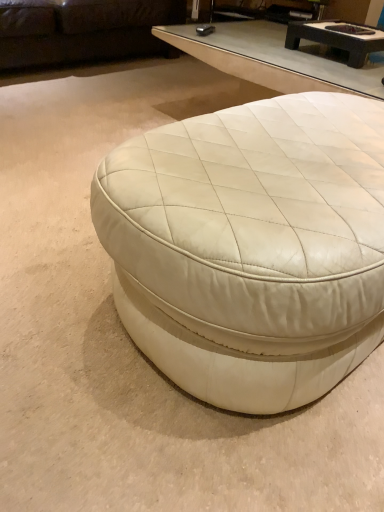
Question: Is white leather ottoman at center, acting as the 1th coffee table starting from the bottom, looking in the opposite direction of dark brown textured wood coffee table at upper center, acting as the 1th coffee table starting from the back?

Choices:
 (A) yes
 (B) no

Answer: (B)

Question: Is white leather ottoman at center, acting as the 1th coffee table starting from the bottom, behind dark brown textured wood coffee table at upper center, acting as the 1th coffee table starting from the back?

Choices:
 (A) yes
 (B) no

Answer: (B)

Question: Considering the relative sizes of white leather ottoman at center, positioned as the second coffee table in top-to-bottom order, and dark brown textured wood coffee table at upper center, the second coffee table in the bottom-to-top sequence, in the image provided, is white leather ottoman at center, positioned as the second coffee table in top-to-bottom order, shorter than dark brown textured wood coffee table at upper center, the second coffee table in the bottom-to-top sequence,?

Choices:
 (A) yes
 (B) no

Answer: (B)

Question: Is white leather ottoman at center, which is the 2th coffee table in back-to-front order, directly adjacent to dark brown textured wood coffee table at upper center, acting as the second coffee table starting from the front?

Choices:
 (A) no
 (B) yes

Answer: (A)

Question: Is the depth of white leather ottoman at center, acting as the 1th coffee table starting from the bottom, less than that of dark brown textured wood coffee table at upper center, acting as the 1th coffee table starting from the back?

Choices:
 (A) yes
 (B) no

Answer: (A)

Question: From a real-world perspective, is white leather ottoman at center, positioned as the second coffee table in top-to-bottom order, under dark brown textured wood coffee table at upper center, the second coffee table in the bottom-to-top sequence?

Choices:
 (A) no
 (B) yes

Answer: (B)

Question: Can you confirm if dark brown textured wood coffee table at upper center, acting as the second coffee table starting from the front, is shorter than white leather ottoman at center, which is the 2th coffee table in back-to-front order?

Choices:
 (A) no
 (B) yes

Answer: (B)

Question: Is dark brown textured wood coffee table at upper center, positioned as the first coffee table in top-to-bottom order, outside of white leather ottoman at center, the 1th coffee table in the front-to-back sequence?

Choices:
 (A) no
 (B) yes

Answer: (B)

Question: Is dark brown textured wood coffee table at upper center, acting as the 1th coffee table starting from the back, wider than white leather ottoman at center, the 1th coffee table in the front-to-back sequence?

Choices:
 (A) no
 (B) yes

Answer: (A)

Question: From a real-world perspective, is dark brown textured wood coffee table at upper center, acting as the second coffee table starting from the front, on top of white leather ottoman at center, which is the 2th coffee table in back-to-front order?

Choices:
 (A) no
 (B) yes

Answer: (B)

Question: From the image's perspective, does dark brown textured wood coffee table at upper center, acting as the 1th coffee table starting from the back, appear lower than white leather ottoman at center, acting as the 1th coffee table starting from the bottom?

Choices:
 (A) no
 (B) yes

Answer: (A)

Question: Does dark brown textured wood coffee table at upper center, acting as the 1th coffee table starting from the back, have a greater height compared to white leather ottoman at center, positioned as the second coffee table in top-to-bottom order?

Choices:
 (A) yes
 (B) no

Answer: (B)

Question: Can you confirm if dark brown leather couch at upper left is smaller than dark brown textured wood coffee table at upper center, acting as the second coffee table starting from the front?

Choices:
 (A) no
 (B) yes

Answer: (A)